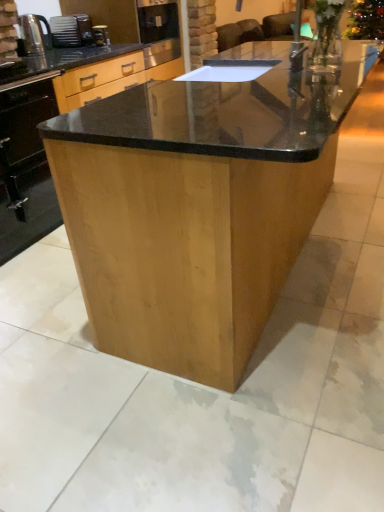
Measure the distance between metallic silver kettle at left and camera.

A distance of 2.49 meters exists between metallic silver kettle at left and camera.

Where is `shiny brown wood table at center`? Image resolution: width=384 pixels, height=512 pixels. shiny brown wood table at center is located at coordinates (197, 207).

In order to face shiny brown wood table at center, should I rotate leftwards or rightwards?

It's best to rotate right around 9.705 degrees.

This screenshot has width=384, height=512. What do you see at coordinates (25, 169) in the screenshot?
I see `black glossy oven at lower left` at bounding box center [25, 169].

You are a GUI agent. You are given a task and a screenshot of the screen. Output one action in this format:
    pyautogui.click(x=<x>, y=<y>)
    Task: Click on the satin black toaster at upper left
    The image size is (384, 512).
    Given the screenshot: What is the action you would take?
    pyautogui.click(x=71, y=31)

What do you see at coordinates (71, 31) in the screenshot? Image resolution: width=384 pixels, height=512 pixels. I see `satin black toaster at upper left` at bounding box center [71, 31].

In order to click on metallic silver kettle at left in this screenshot , I will do `click(34, 33)`.

Which point is more distant from viewer, (101, 27) or (29, 38)?

The point (101, 27) is farther.

Is metallic silver coffee machine at upper left facing away from metallic silver kettle at left?

No, metallic silver coffee machine at upper left's orientation is not away from metallic silver kettle at left.

Is metallic silver coffee machine at upper left closer to the viewer compared to metallic silver kettle at left?

No.

Is metallic silver coffee machine at upper left taller or shorter than metallic silver kettle at left?

metallic silver coffee machine at upper left is shorter than metallic silver kettle at left.

Which object is closer to the camera, metallic silver coffee machine at upper left or satin black toaster at upper left?

metallic silver coffee machine at upper left is closer to the camera.

Which of these two, metallic silver coffee machine at upper left or satin black toaster at upper left, is bigger?

Bigger between the two is satin black toaster at upper left.

The image size is (384, 512). Find the location of `appliance above the metallic silver coffee machine at upper left (from a real-world perspective)`. appliance above the metallic silver coffee machine at upper left (from a real-world perspective) is located at coordinates (71, 31).

Are metallic silver coffee machine at upper left and satin black toaster at upper left beside each other?

No, metallic silver coffee machine at upper left is not making contact with satin black toaster at upper left.

Is metallic silver kettle at left not close to shiny brown wood table at center?

Absolutely, metallic silver kettle at left is distant from shiny brown wood table at center.

Does metallic silver kettle at left have a lesser width compared to shiny brown wood table at center?

Indeed, metallic silver kettle at left has a lesser width compared to shiny brown wood table at center.

From the image's perspective, which one is positioned lower, metallic silver kettle at left or shiny brown wood table at center?

shiny brown wood table at center is shown below in the image.

Is shiny brown wood table at center next to black glossy oven at lower left and touching it?

No, shiny brown wood table at center is not in contact with black glossy oven at lower left.

From a real-world perspective, is shiny brown wood table at center physically below black glossy oven at lower left?

No, from a real-world perspective, shiny brown wood table at center is not beneath black glossy oven at lower left.

This screenshot has width=384, height=512. I want to click on oven above the shiny brown wood table at center (from the image's perspective), so click(x=25, y=169).

From the picture: Looking at their sizes, would you say shiny brown wood table at center is wider or thinner than black glossy oven at lower left?

Considering their sizes, shiny brown wood table at center looks broader than black glossy oven at lower left.

Does shiny brown wood table at center turn towards metallic silver coffee machine at upper left?

No.

Considering the relative sizes of shiny brown wood table at center and metallic silver coffee machine at upper left in the image provided, is shiny brown wood table at center thinner than metallic silver coffee machine at upper left?

In fact, shiny brown wood table at center might be wider than metallic silver coffee machine at upper left.

Based on the photo, is there a large distance between shiny brown wood table at center and metallic silver coffee machine at upper left?

shiny brown wood table at center is positioned a significant distance from metallic silver coffee machine at upper left.

At what (x,y) coordinates should I click in order to perform the action: click on table in front of the metallic silver coffee machine at upper left. Please return your answer as a coordinate pair (x, y). This screenshot has height=512, width=384. Looking at the image, I should click on (197, 207).

Considering the relative positions of black glossy oven at lower left and shiny brown wood table at center in the image provided, is black glossy oven at lower left to the left of shiny brown wood table at center from the viewer's perspective?

Correct, you'll find black glossy oven at lower left to the left of shiny brown wood table at center.

Would you consider black glossy oven at lower left to be distant from shiny brown wood table at center?

That's right, there is a large distance between black glossy oven at lower left and shiny brown wood table at center.

From the image's perspective, which is above, black glossy oven at lower left or shiny brown wood table at center?

black glossy oven at lower left.

Locate an element on the screen. table on the right of black glossy oven at lower left is located at coordinates (197, 207).

Does black glossy oven at lower left turn towards metallic silver coffee machine at upper left?

No, black glossy oven at lower left is not oriented towards metallic silver coffee machine at upper left.

Is the position of black glossy oven at lower left more distant than that of metallic silver coffee machine at upper left?

No, it is not.

Consider the image. How distant is black glossy oven at lower left from metallic silver coffee machine at upper left?

black glossy oven at lower left is 4.79 feet away from metallic silver coffee machine at upper left.

Visually, is black glossy oven at lower left positioned to the left or to the right of metallic silver coffee machine at upper left?

black glossy oven at lower left is to the left of metallic silver coffee machine at upper left.

Where is `kitchen appliance that appears above the metallic silver coffee machine at upper left (from a real-world perspective)`? The height and width of the screenshot is (512, 384). kitchen appliance that appears above the metallic silver coffee machine at upper left (from a real-world perspective) is located at coordinates (34, 33).

At what (x,y) coordinates should I click in order to perform the action: click on appliance on the left of the metallic silver coffee machine at upper left. Please return your answer as a coordinate pair (x, y). Image resolution: width=384 pixels, height=512 pixels. Looking at the image, I should click on (71, 31).

Estimate the real-world distances between objects in this image. Which object is closer to satin black toaster at upper left, shiny brown wood table at center or metallic silver kettle at left?

The object closer to satin black toaster at upper left is metallic silver kettle at left.

When comparing their distances from shiny brown wood table at center, does metallic silver kettle at left or metallic silver coffee machine at upper left seem closer?

Among the two, metallic silver kettle at left is located nearer to shiny brown wood table at center.

When comparing their distances from metallic silver kettle at left, does shiny brown wood table at center or metallic silver coffee machine at upper left seem further?

Based on the image, shiny brown wood table at center appears to be further to metallic silver kettle at left.

Based on their spatial positions, is satin black toaster at upper left or metallic silver coffee machine at upper left further from black glossy oven at lower left?

metallic silver coffee machine at upper left lies further to black glossy oven at lower left than the other object.

Looking at this image, based on their spatial positions, is metallic silver coffee machine at upper left or metallic silver kettle at left further from satin black toaster at upper left?

The object further to satin black toaster at upper left is metallic silver kettle at left.

Looking at the image, which one is located further to metallic silver coffee machine at upper left, satin black toaster at upper left or metallic silver kettle at left?

metallic silver kettle at left lies further to metallic silver coffee machine at upper left than the other object.

When comparing their distances from satin black toaster at upper left, does black glossy oven at lower left or shiny brown wood table at center seem closer?

black glossy oven at lower left is closer to satin black toaster at upper left.

Considering their positions, is metallic silver kettle at left positioned further to satin black toaster at upper left than metallic silver coffee machine at upper left?

metallic silver kettle at left is positioned further to the anchor satin black toaster at upper left.

Identify the location of kitchen appliance between black glossy oven at lower left and metallic silver coffee machine at upper left along the z-axis. (34, 33).

At what (x,y) coordinates should I click in order to perform the action: click on oven between shiny brown wood table at center and metallic silver coffee machine at upper left in the front-back direction. Please return your answer as a coordinate pair (x, y). Looking at the image, I should click on (25, 169).

Find the location of a particular element. This screenshot has width=384, height=512. coffee machine between black glossy oven at lower left and satin black toaster at upper left from front to back is located at coordinates (101, 35).

I want to click on kitchen appliance between satin black toaster at upper left and black glossy oven at lower left from top to bottom, so click(x=34, y=33).